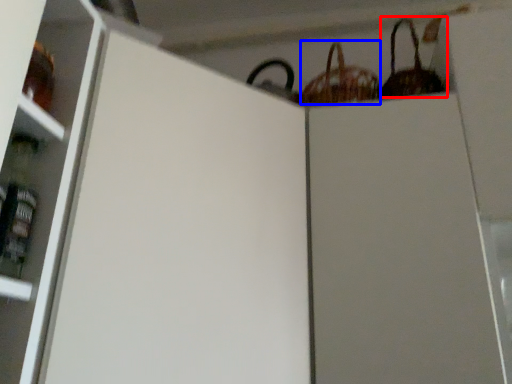
Question: Among these objects, which one is nearest to the camera, basket (highlighted by a red box) or basket (highlighted by a blue box)?

Choices:
 (A) basket
 (B) basket

Answer: (A)